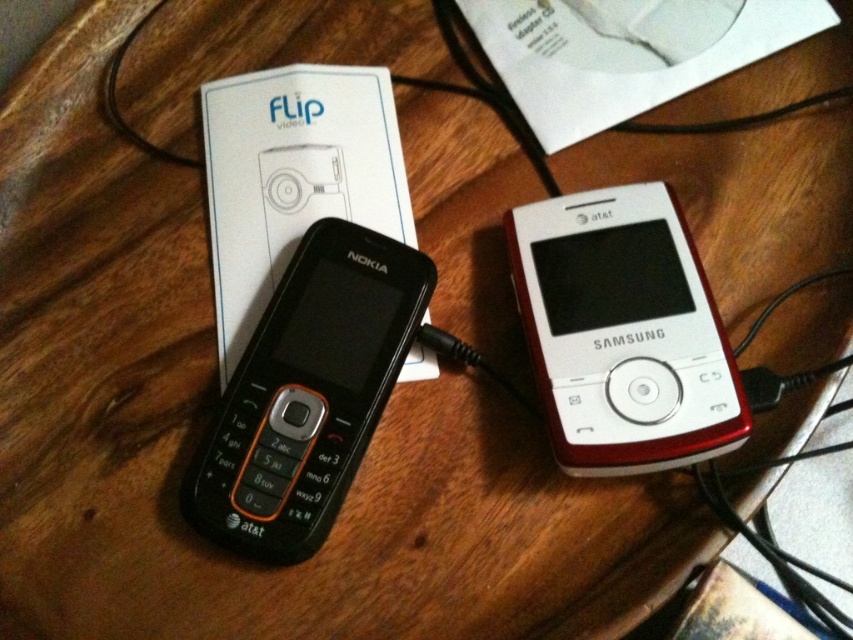
Which of these two, black plastic nokia phone at center or black plastic earphone at center, stands shorter?

black plastic earphone at center

Which is more to the right, black plastic nokia phone at center or black plastic earphone at center?

black plastic nokia phone at center

Which is in front, point (340, 234) or point (299, 202)?

Point (340, 234) is in front.

The height and width of the screenshot is (640, 853). I want to click on black plastic nokia phone at center, so click(x=306, y=394).

This screenshot has height=640, width=853. What do you see at coordinates (624, 332) in the screenshot? I see `white glossy ipod at center` at bounding box center [624, 332].

The image size is (853, 640). What are the coordinates of `white glossy ipod at center` in the screenshot? It's located at (624, 332).

The image size is (853, 640). Find the location of `white glossy ipod at center`. white glossy ipod at center is located at coordinates (624, 332).

Who is shorter, white glossy ipod at center or black plastic earphone at center?

black plastic earphone at center

Between point (651, 381) and point (283, 259), which one is positioned in front?

Point (651, 381) is in front.

What are the coordinates of `white glossy ipod at center` in the screenshot? It's located at (624, 332).